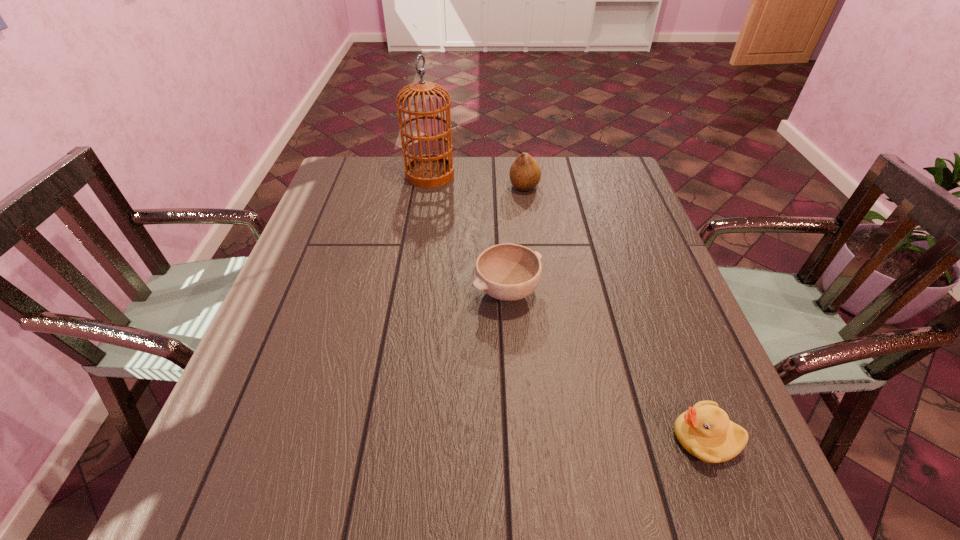
Identify the location of birdcage. The height and width of the screenshot is (540, 960). (430, 170).

Identify the location of the tallest object. The height and width of the screenshot is (540, 960). (430, 170).

The width and height of the screenshot is (960, 540). In order to click on pear in this screenshot , I will do [525, 173].

Find the location of a particular element. the third farthest object is located at coordinates (508, 272).

In order to click on the rightmost object in this screenshot , I will do `click(705, 431)`.

Identify the location of duckling. The height and width of the screenshot is (540, 960). (705, 431).

This screenshot has width=960, height=540. Find the location of `free space located 0.180m on the front of the leftmost object`. free space located 0.180m on the front of the leftmost object is located at coordinates [x=422, y=224].

Image resolution: width=960 pixels, height=540 pixels. In order to click on free space located 0.110m on the back of the pear in this screenshot , I will do `click(521, 160)`.

At what (x,y) coordinates should I click in order to perform the action: click on vacant region located 0.170m on the left of the bowl. Please return your answer as a coordinate pair (x, y). Looking at the image, I should click on (x=400, y=292).

The height and width of the screenshot is (540, 960). I want to click on vacant space located 0.170m at the face of the nearest object, so click(x=576, y=438).